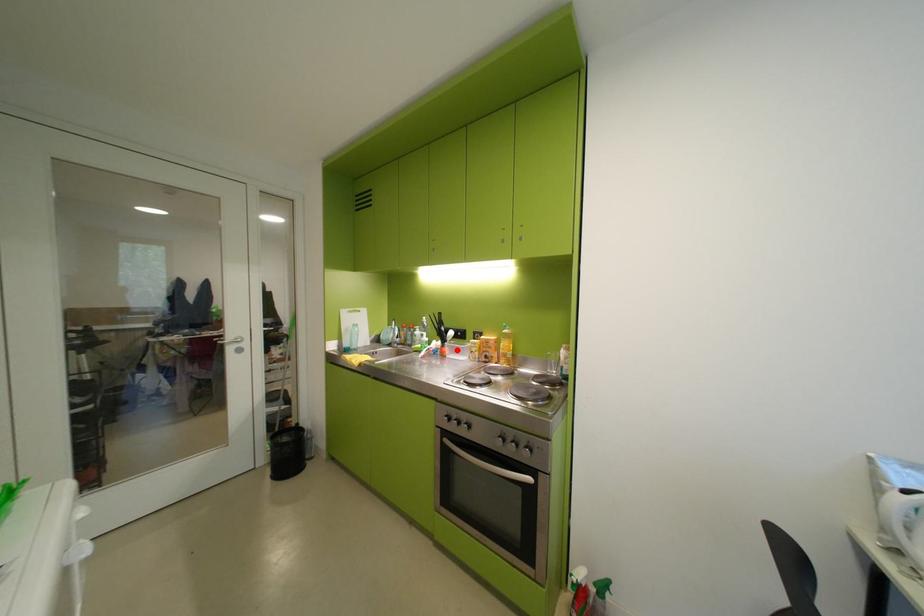
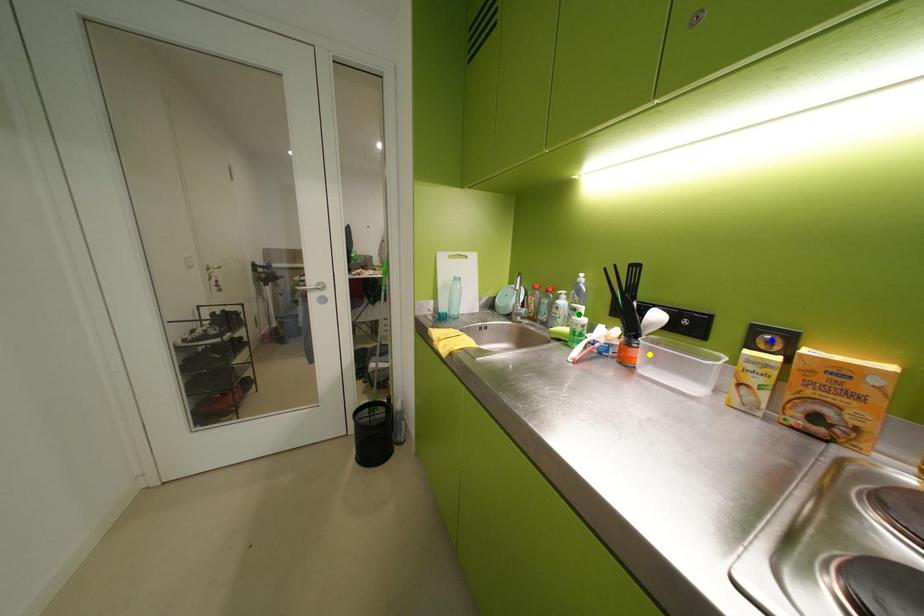
Question: I am providing you with two images of the same scene from different viewpoints. A red point is marked on the first image. You are given multiple points on the second image. Can you choose the point in image 2 that corresponds to the point in image 1?

Choices:
 (A) blue point
 (B) yellow point
 (C) green point

Answer: (B)